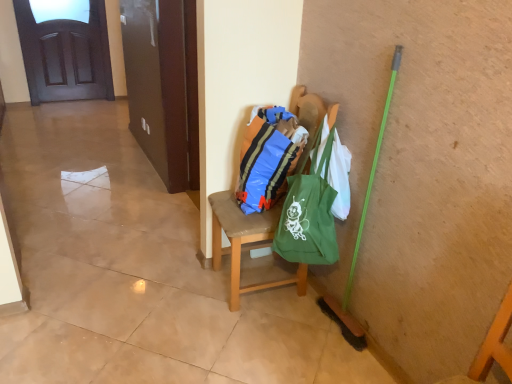
The height and width of the screenshot is (384, 512). Identify the location of free point below green fabric bag at center (from a real-world perspective). (320, 302).